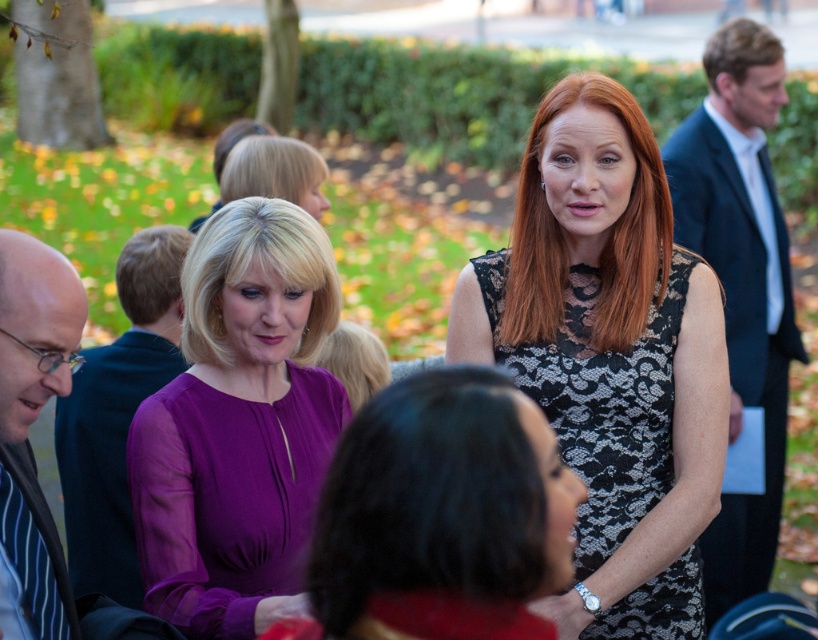
Can you confirm if dark blue suit at right is wider than matte black suit at left?

Correct, the width of dark blue suit at right exceeds that of matte black suit at left.

Which is more to the left, dark blue suit at right or matte black suit at left?

matte black suit at left is more to the left.

Is point (749, 516) less distant than point (129, 326)?

Yes, point (749, 516) is in front of point (129, 326).

Identify the location of dark blue suit at right. (740, 282).

Between purple satin blouse at center and striped fabric shirt at left, which one has more height?

purple satin blouse at center is taller.

Locate an element on the screen. This screenshot has width=818, height=640. purple satin blouse at center is located at coordinates (239, 426).

At what (x,y) coordinates should I click in order to perform the action: click on purple satin blouse at center. Please return your answer as a coordinate pair (x, y). The height and width of the screenshot is (640, 818). Looking at the image, I should click on (239, 426).

Can you confirm if dark blue suit at right is taller than striped fabric shirt at left?

Yes.

Which is more to the left, dark blue suit at right or striped fabric shirt at left?

Positioned to the left is striped fabric shirt at left.

The width and height of the screenshot is (818, 640). What do you see at coordinates (740, 282) in the screenshot? I see `dark blue suit at right` at bounding box center [740, 282].

Locate an element on the screen. Image resolution: width=818 pixels, height=640 pixels. dark blue suit at right is located at coordinates (740, 282).